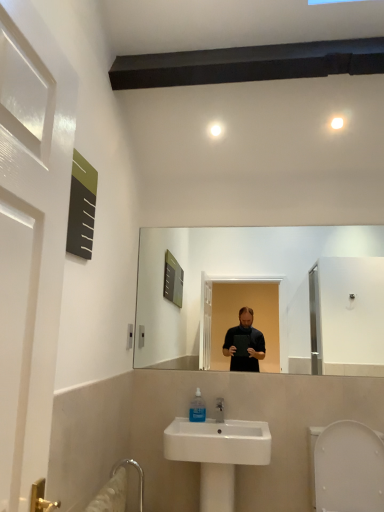
Question: Does white plastic bidet at lower right appear on the right side of translucent plastic mouthwash at sink?

Choices:
 (A) yes
 (B) no

Answer: (A)

Question: From the image's perspective, is white plastic bidet at lower right on translucent plastic mouthwash at sink?

Choices:
 (A) no
 (B) yes

Answer: (A)

Question: Is white plastic bidet at lower right turned away from translucent plastic mouthwash at sink?

Choices:
 (A) no
 (B) yes

Answer: (A)

Question: Can you confirm if white plastic bidet at lower right is positioned to the left of translucent plastic mouthwash at sink?

Choices:
 (A) yes
 (B) no

Answer: (B)

Question: Is white plastic bidet at lower right oriented towards translucent plastic mouthwash at sink?

Choices:
 (A) yes
 (B) no

Answer: (B)

Question: Is white plastic bidet at lower right situated inside white ceramic sink at lower center or outside?

Choices:
 (A) outside
 (B) inside

Answer: (A)

Question: Looking at their shapes, would you say white plastic bidet at lower right is wider or thinner than white ceramic sink at lower center?

Choices:
 (A) wide
 (B) thin

Answer: (A)

Question: From a real-world perspective, is white plastic bidet at lower right physically located above or below white ceramic sink at lower center?

Choices:
 (A) above
 (B) below

Answer: (B)

Question: Is point (316, 492) closer or farther from the camera than point (185, 423)?

Choices:
 (A) closer
 (B) farther

Answer: (A)

Question: From a real-world perspective, is translucent plastic mouthwash at sink positioned above or below white plastic bidet at lower right?

Choices:
 (A) below
 (B) above

Answer: (B)

Question: Looking at their shapes, would you say translucent plastic mouthwash at sink is wider or thinner than white plastic bidet at lower right?

Choices:
 (A) wide
 (B) thin

Answer: (B)

Question: Is translucent plastic mouthwash at sink in front of or behind white plastic bidet at lower right in the image?

Choices:
 (A) front
 (B) behind

Answer: (B)

Question: From the image's perspective, relative to white plastic bidet at lower right, is translucent plastic mouthwash at sink above or below?

Choices:
 (A) above
 (B) below

Answer: (A)

Question: In terms of size, does white ceramic sink at lower center appear bigger or smaller than translucent plastic mouthwash at sink?

Choices:
 (A) small
 (B) big

Answer: (B)

Question: In the image, is white ceramic sink at lower center on the left side or the right side of translucent plastic mouthwash at sink?

Choices:
 (A) right
 (B) left

Answer: (A)